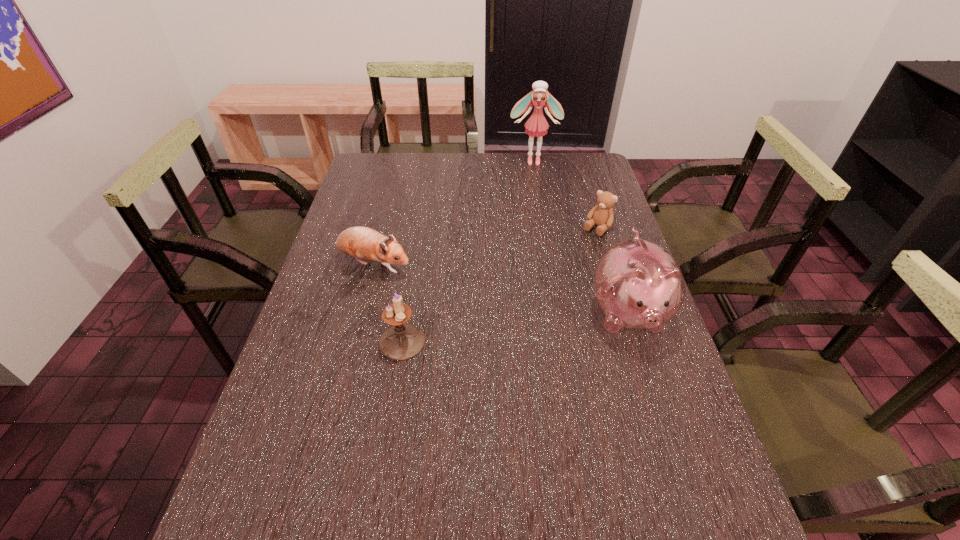
Where is `vacant space located 0.160m at the face of the hamster`? vacant space located 0.160m at the face of the hamster is located at coordinates (453, 292).

I want to click on vacant space positioned on the face of the fourth nearest object, so click(521, 312).

Image resolution: width=960 pixels, height=540 pixels. In order to click on blank space located on the face of the fourth nearest object in this screenshot , I will do `click(539, 292)`.

This screenshot has height=540, width=960. Find the location of `vacant space located on the face of the fourth nearest object`. vacant space located on the face of the fourth nearest object is located at coordinates (572, 256).

Where is `vacant space positioned 0.310m on the front-facing side of the doll`? vacant space positioned 0.310m on the front-facing side of the doll is located at coordinates (536, 214).

Locate an element on the screen. vacant position located on the front-facing side of the doll is located at coordinates (535, 188).

At what (x,y) coordinates should I click in order to perform the action: click on blank area located 0.310m on the front-facing side of the doll. Please return your answer as a coordinate pair (x, y). Looking at the image, I should click on (536, 214).

Image resolution: width=960 pixels, height=540 pixels. I want to click on object positioned at the far edge, so click(536, 125).

You are a GUI agent. You are given a task and a screenshot of the screen. Output one action in this format:
    pyautogui.click(x=<x>, y=<y>)
    Task: Click on the object at the left edge
    Image resolution: width=960 pixels, height=540 pixels.
    Given the screenshot: What is the action you would take?
    (x=363, y=243)

Find the location of a particular element. piggy bank that is at the right edge is located at coordinates (638, 284).